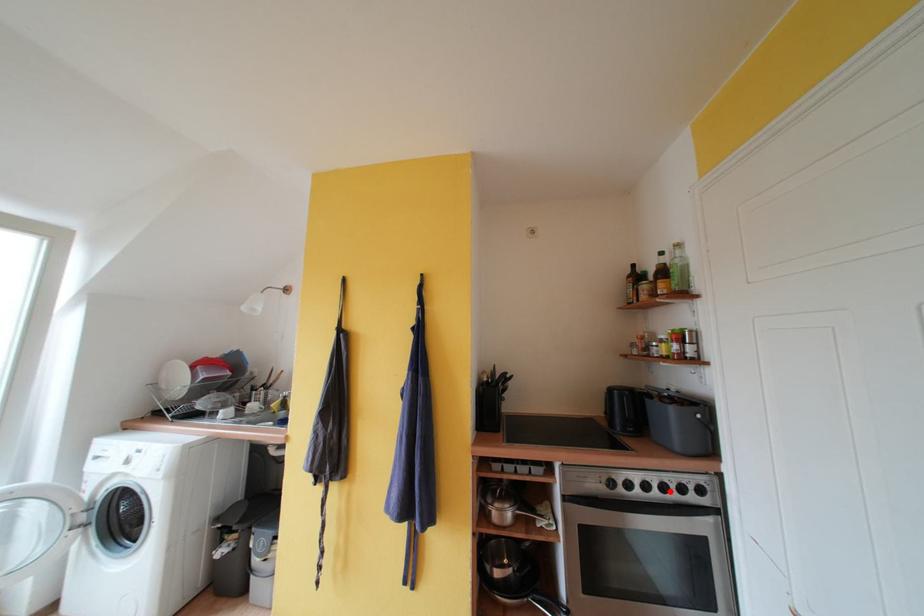
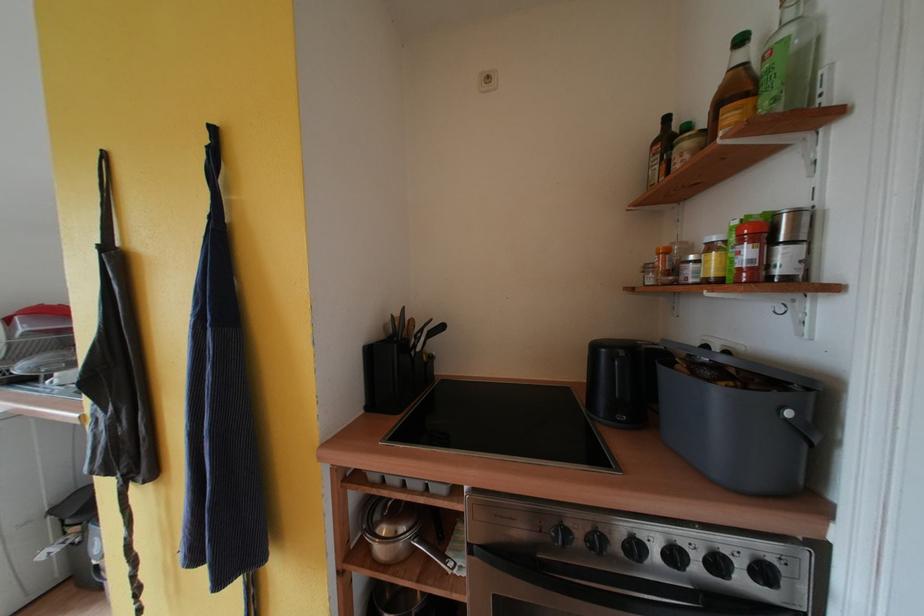
Find the pixel in the second image that matches the highlighted location in the first image.

(681, 560)